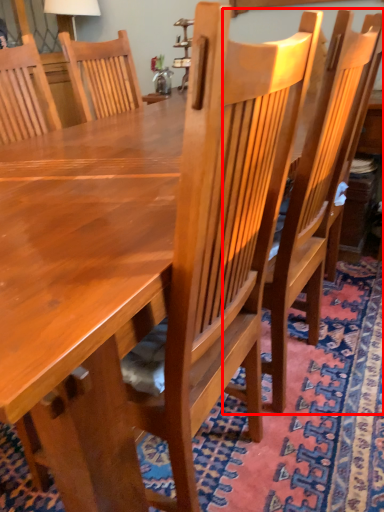
Question: From the image's perspective, what is the correct spatial relationship of chair (annotated by the red box) in relation to mat?

Choices:
 (A) above
 (B) below

Answer: (A)